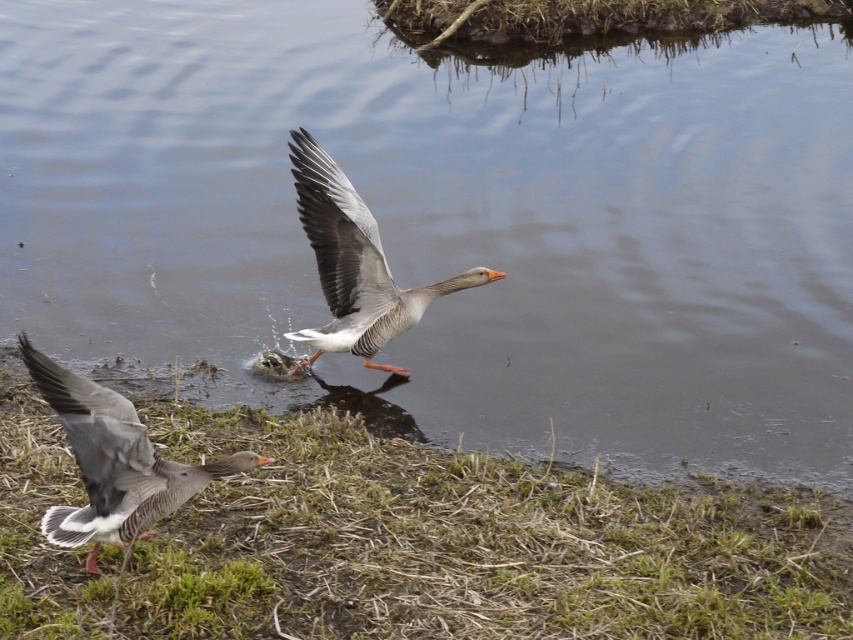
Question: Which is nearer to the green dry grass at lower left?

Choices:
 (A) gray matte duck at lower left
 (B) gray matte goose at center

Answer: (A)

Question: Can you confirm if gray matte duck at lower left is smaller than gray matte goose at center?

Choices:
 (A) yes
 (B) no

Answer: (A)

Question: Does green dry grass at lower left appear over gray matte duck at lower left?

Choices:
 (A) yes
 (B) no

Answer: (B)

Question: Which of the following is the closest to the observer?

Choices:
 (A) gray matte goose at center
 (B) green dry grass at lower left

Answer: (B)

Question: Which point appears closest to the camera in this image?

Choices:
 (A) (328, 333)
 (B) (387, 536)

Answer: (B)

Question: Is green dry grass at lower left closer to the viewer compared to gray matte duck at lower left?

Choices:
 (A) yes
 (B) no

Answer: (B)